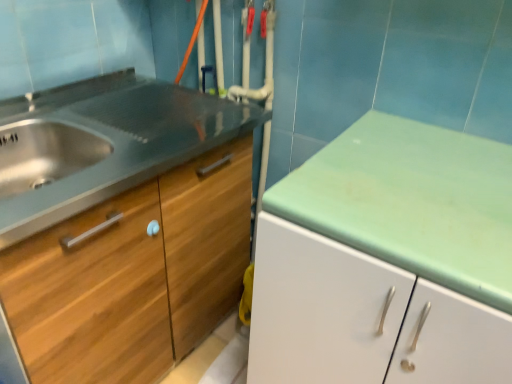
Question: Looking at their shapes, would you say wooden cabinet at left is wider or thinner than wooden drawer at left?

Choices:
 (A) thin
 (B) wide

Answer: (B)

Question: Considering the positions of point (154, 213) and point (51, 331), is point (154, 213) closer or farther from the camera than point (51, 331)?

Choices:
 (A) closer
 (B) farther

Answer: (B)

Question: From the image's perspective, relative to wooden drawer at left, is wooden cabinet at left above or below?

Choices:
 (A) above
 (B) below

Answer: (B)

Question: Is point (123, 249) closer or farther from the camera than point (90, 210)?

Choices:
 (A) closer
 (B) farther

Answer: (B)

Question: Is wooden drawer at left to the left or to the right of wooden cabinet at left in the image?

Choices:
 (A) right
 (B) left

Answer: (B)

Question: Relative to wooden cabinet at left, is wooden drawer at left in front or behind?

Choices:
 (A) behind
 (B) front

Answer: (B)

Question: Choose the correct answer: Is wooden drawer at left inside wooden cabinet at left or outside it?

Choices:
 (A) outside
 (B) inside

Answer: (B)